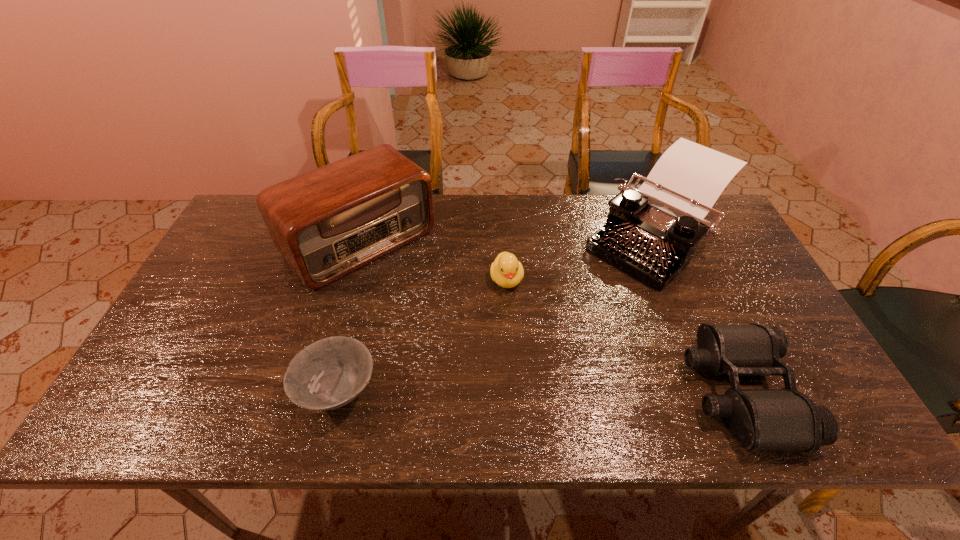
Find the location of a particular element. Image resolution: width=960 pixels, height=540 pixels. vacant region located on the keys of the typewriter is located at coordinates (541, 341).

Identify the location of free location located on the keys of the typewriter. This screenshot has height=540, width=960. (580, 306).

This screenshot has width=960, height=540. I want to click on blank space located on the front panel of the radio receiver, so coord(428,308).

At what (x,y) coordinates should I click in order to perform the action: click on vacant region located 0.250m on the front panel of the radio receiver. Please return your answer as a coordinate pair (x, y). This screenshot has height=540, width=960. Looking at the image, I should click on (455, 336).

Identify the location of vacant space situated on the front panel of the radio receiver. This screenshot has width=960, height=540. (418, 298).

Where is `free space located 0.160m on the beak of the third object from left to right`? free space located 0.160m on the beak of the third object from left to right is located at coordinates (516, 343).

This screenshot has width=960, height=540. In order to click on vacant space located on the beak of the third object from left to right in this screenshot , I will do `click(523, 379)`.

Locate an element on the screen. The width and height of the screenshot is (960, 540). blank space located 0.170m on the beak of the third object from left to right is located at coordinates (517, 347).

The width and height of the screenshot is (960, 540). What are the coordinates of `typewriter that is at the far edge` in the screenshot? It's located at (651, 233).

Find the location of a particular element. The height and width of the screenshot is (540, 960). radio receiver located at the far edge is located at coordinates (326, 223).